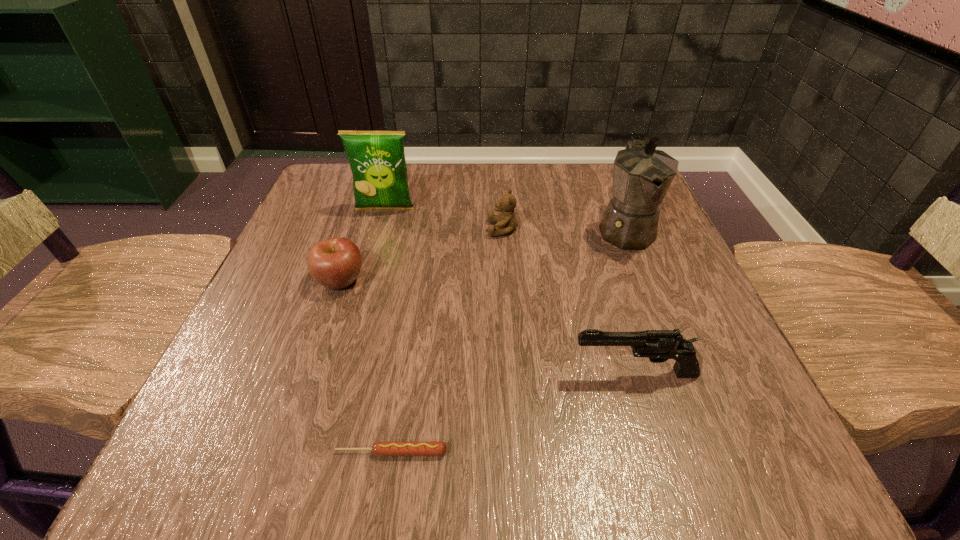
Image resolution: width=960 pixels, height=540 pixels. In order to click on vacant space at the far left corner of the desktop in this screenshot , I will do `click(346, 204)`.

You are a GUI agent. You are given a task and a screenshot of the screen. Output one action in this format:
    pyautogui.click(x=<x>, y=<y>)
    Task: Click on the free space at the near left corner
    
    Given the screenshot: What is the action you would take?
    pyautogui.click(x=197, y=442)

Image resolution: width=960 pixels, height=540 pixels. I want to click on vacant area that lies between the nearest object and the fourth object from left to right, so click(447, 341).

The width and height of the screenshot is (960, 540). I want to click on free space between the nearest object and the crisp (potato chip), so click(x=388, y=330).

The image size is (960, 540). Find the location of `empty space between the third nearest object and the gun`. empty space between the third nearest object and the gun is located at coordinates (488, 327).

Find the location of a particular element. free space between the teddy bear and the third nearest object is located at coordinates (421, 254).

This screenshot has height=540, width=960. I want to click on free space between the gun and the coffeepot, so click(x=630, y=302).

The height and width of the screenshot is (540, 960). Identify the location of free space that is in between the fifth farthest object and the coffeepot. (630, 302).

I want to click on free space that is in between the crisp (potato chip) and the gun, so click(510, 291).

Where is `vacant area that lies between the coffeepot and the second nearest object`? This screenshot has width=960, height=540. vacant area that lies between the coffeepot and the second nearest object is located at coordinates (630, 302).